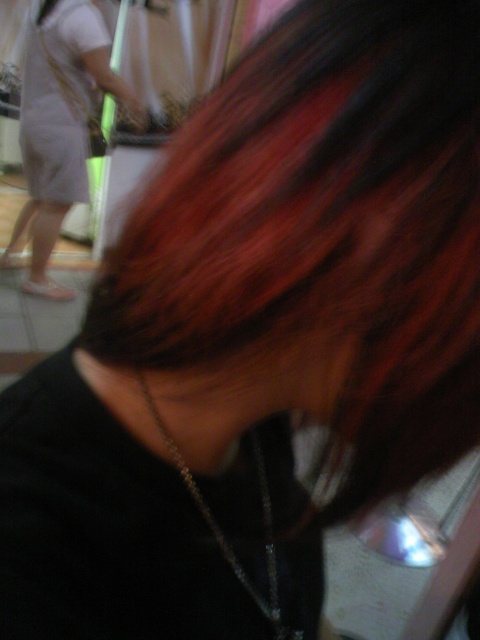
Question: Is shiny dark brown hair at center above matte white dress at upper left?

Choices:
 (A) yes
 (B) no

Answer: (B)

Question: Which point is closer to the camera taking this photo?

Choices:
 (A) (276, 637)
 (B) (108, 74)

Answer: (A)

Question: Does matte white dress at upper left appear on the right side of silver metallic chain at center?

Choices:
 (A) yes
 (B) no

Answer: (B)

Question: Which object appears closest to the camera in this image?

Choices:
 (A) silver metallic chain at center
 (B) matte white dress at upper left

Answer: (A)

Question: From the image, what is the correct spatial relationship of shiny dark brown hair at center in relation to silver metallic chain at center?

Choices:
 (A) left
 (B) right

Answer: (B)

Question: Considering the real-world distances, which object is closest to the matte white dress at upper left?

Choices:
 (A) silver metallic chain at center
 (B) shiny dark brown hair at center

Answer: (B)